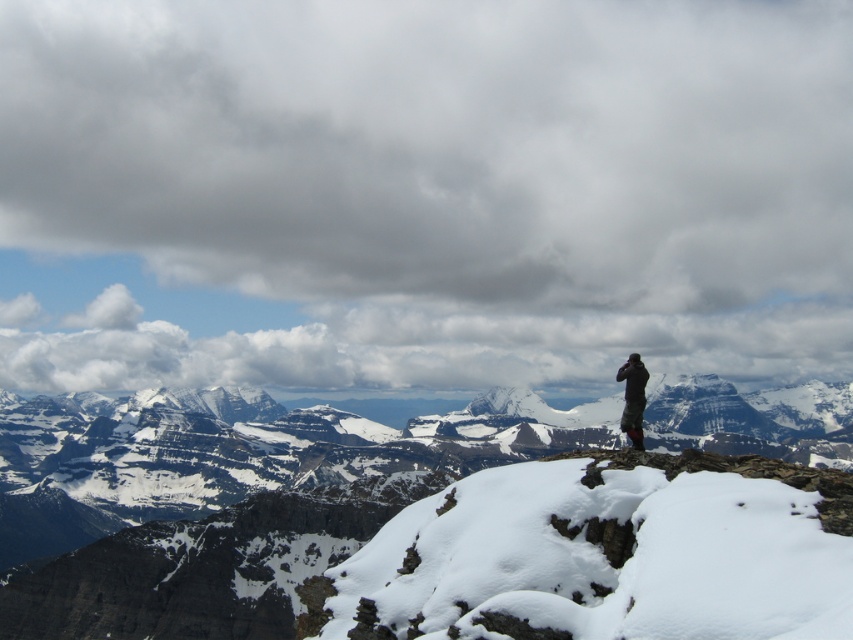
Is point (48, 44) closer to camera compared to point (154, 442)?

No, it is behind (154, 442).

Is point (560, 220) behind point (788, 589)?

Yes, point (560, 220) is behind point (788, 589).

The image size is (853, 640). I want to click on cloudy sky at upper center, so click(422, 193).

Looking at this image, between cloudy sky at upper center and dark gray fabric at upper right, which one appears on the left side from the viewer's perspective?

Positioned to the left is cloudy sky at upper center.

Is the position of cloudy sky at upper center more distant than that of dark gray fabric at upper right?

That is True.

Between point (650, 294) and point (637, 436), which one is positioned in front?

Point (637, 436) is more forward.

Locate an element on the screen. The image size is (853, 640). cloudy sky at upper center is located at coordinates (422, 193).

Is snowy rocky mountain at center to the left of dark gray fabric at upper right from the viewer's perspective?

Yes, snowy rocky mountain at center is to the left of dark gray fabric at upper right.

Is point (196, 413) positioned before point (631, 392)?

No.

This screenshot has height=640, width=853. I want to click on snowy rocky mountain at center, so click(424, 529).

Locate an element on the screen. The width and height of the screenshot is (853, 640). snowy rocky mountain at center is located at coordinates (424, 529).